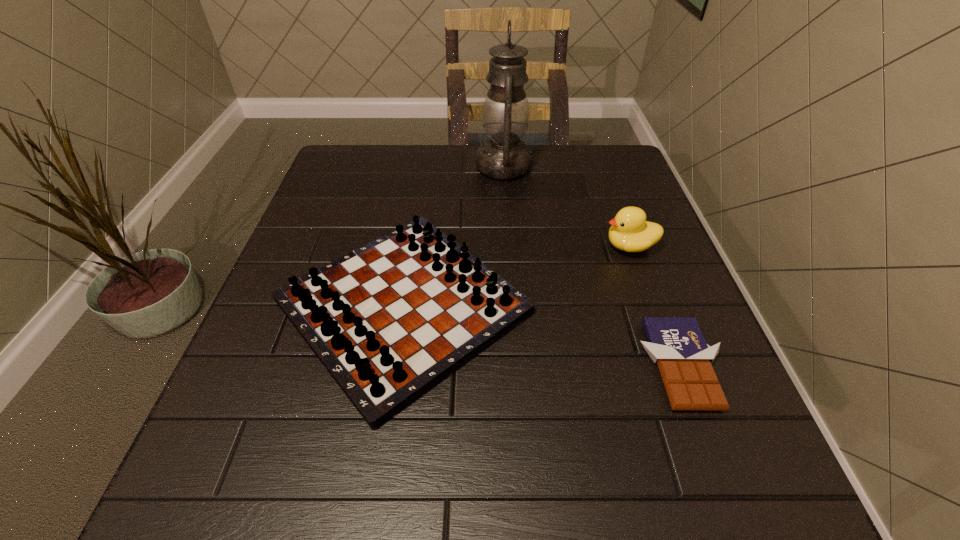
The width and height of the screenshot is (960, 540). In order to click on the closest object to the chessboard in this screenshot , I will do `click(505, 115)`.

The image size is (960, 540). I want to click on free space that satisfies the following two spatial constraints: 1. on the front side of the tallest object; 2. on the left side of the chocolate bar, so click(519, 365).

Find the location of a particular element. vacant space that satisfies the following two spatial constraints: 1. on the back side of the shortest object; 2. on the beak of the duckling is located at coordinates (636, 246).

This screenshot has height=540, width=960. I want to click on vacant space that satisfies the following two spatial constraints: 1. on the beak of the duckling; 2. on the back side of the chocolate bar, so click(x=674, y=365).

Where is `free location that satisfies the following two spatial constraints: 1. on the beak of the duckling; 2. on the left side of the shortest object`? The width and height of the screenshot is (960, 540). free location that satisfies the following two spatial constraints: 1. on the beak of the duckling; 2. on the left side of the shortest object is located at coordinates (674, 365).